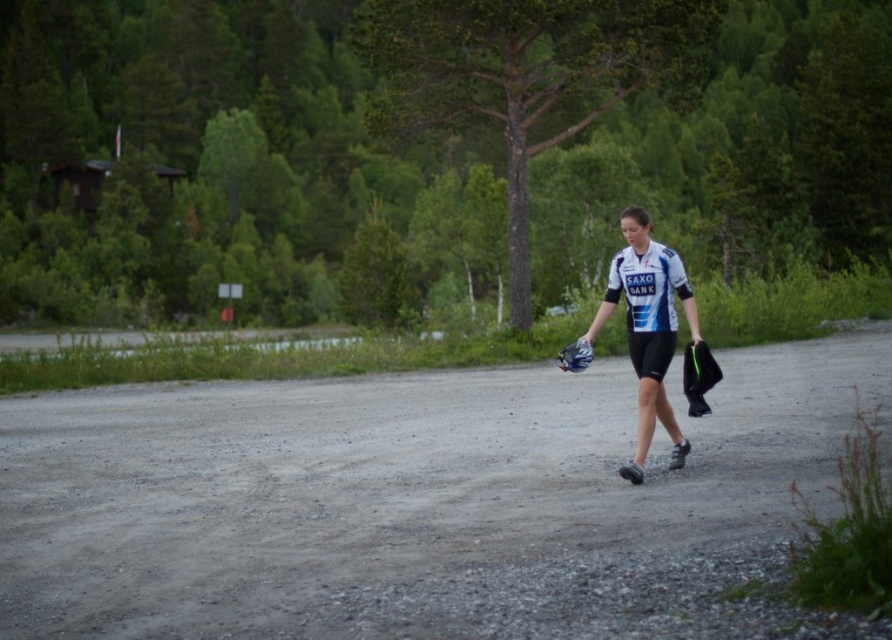
Question: Can you confirm if gray gravel road at center is thinner than white jersey at center?

Choices:
 (A) no
 (B) yes

Answer: (A)

Question: Is white jersey at center to the left of blue fabric baseball glove at center from the viewer's perspective?

Choices:
 (A) yes
 (B) no

Answer: (B)

Question: Which is farther from the gray gravel road at center?

Choices:
 (A) white jersey at center
 (B) blue fabric baseball glove at center

Answer: (B)

Question: Which object is the closest to the blue fabric baseball glove at center?

Choices:
 (A) gray gravel road at center
 (B) white jersey at center

Answer: (B)

Question: Considering the real-world distances, which object is closest to the blue fabric baseball glove at center?

Choices:
 (A) gray gravel road at center
 (B) white jersey at center

Answer: (B)

Question: Can you confirm if gray gravel road at center is smaller than white jersey at center?

Choices:
 (A) no
 (B) yes

Answer: (A)